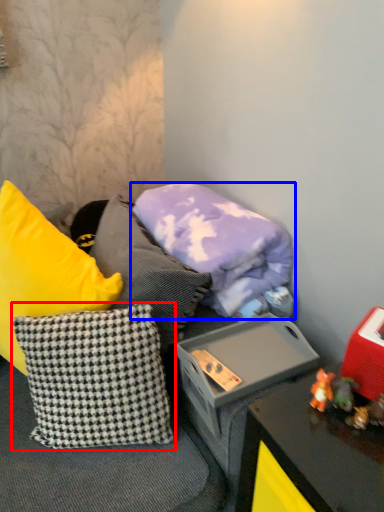
Question: Which of the following is the farthest to the observer, pillow (highlighted by a red box) or pillow (highlighted by a blue box)?

Choices:
 (A) pillow
 (B) pillow

Answer: (B)